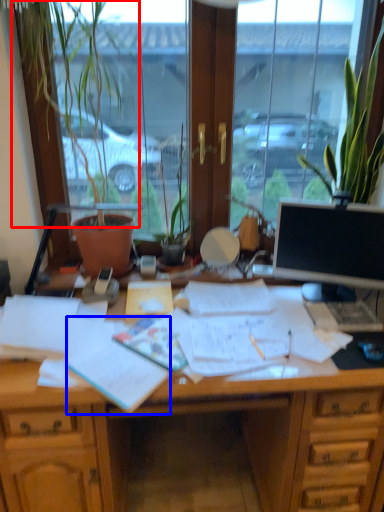
Question: Among these objects, which one is farthest to the camera, plant (highlighted by a red box) or document (highlighted by a blue box)?

Choices:
 (A) plant
 (B) document

Answer: (A)